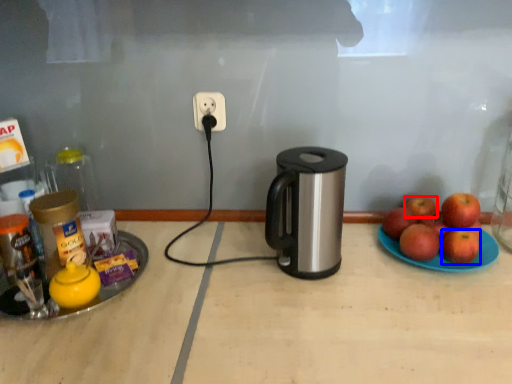
Question: Which object appears closest to the camera in this image, apple (highlighted by a red box) or apple (highlighted by a blue box)?

Choices:
 (A) apple
 (B) apple

Answer: (B)